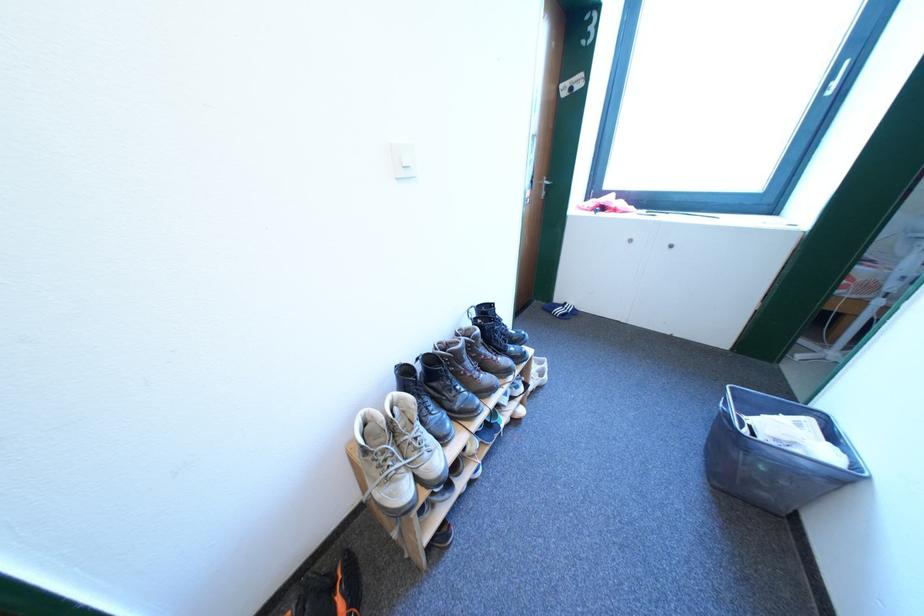
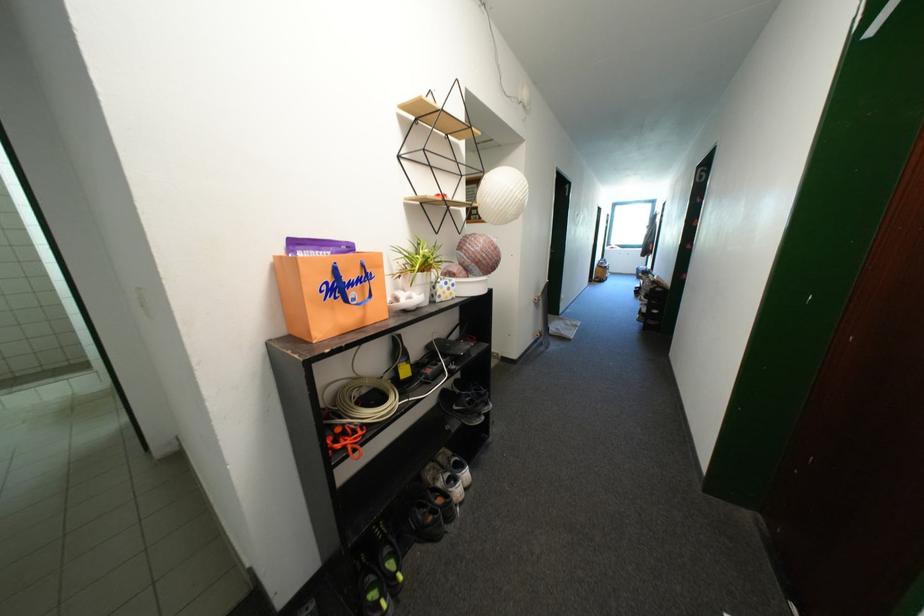
Question: I am providing you with two images of the same scene from different viewpoints. Which of the following objects are not visible in image2?

Choices:
 (A) blue bag handle
 (B) cabinet door handle
 (C) black floor bag
 (D) black sneaker

Answer: (B)